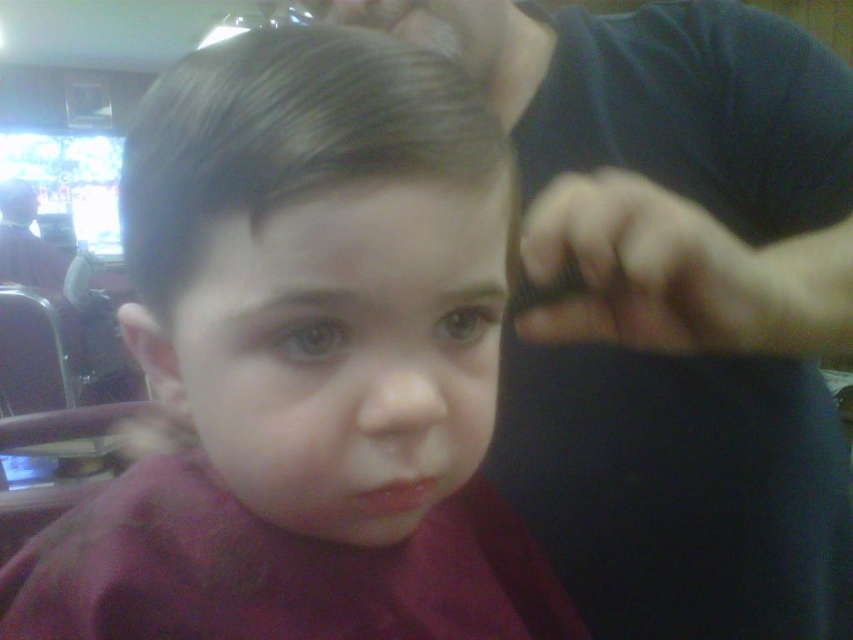
You are a customer in the barbershop and want to know which item is narrower between the matte black hair at center and the dark blue shirt at upper right. Can you tell me?

The matte black hair at center has a lesser width compared to the dark blue shirt at upper right, so the matte black hair at center is narrower.

You are a customer in the barbershop and want to know where the matte black hair at center is located. Can you describe its position relative to the point at coordinates [305,364]?

The point at coordinates [305,364] corresponds exactly to the matte black hair at center, so they are in the same location.

You are a customer in the barbershop and you want to see the haircut style of the child. Which object should you look at first, the matte black hair at center or the dark blue shirt at upper right?

The matte black hair at center is below dark blue shirt at upper right, so you should look at the dark blue shirt at upper right first as it is higher up.